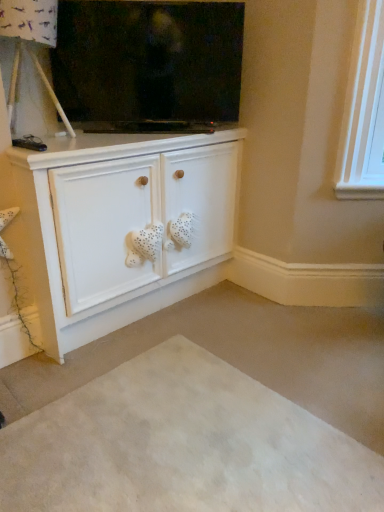
Question: Is flat screen tv at upper center bigger or smaller than beige carpet at lower center?

Choices:
 (A) small
 (B) big

Answer: (B)

Question: Relative to beige carpet at lower center, is flat screen tv at upper center in front or behind?

Choices:
 (A) front
 (B) behind

Answer: (B)

Question: Based on their relative distances, which object is farther from the beige carpet at lower center?

Choices:
 (A) flat screen tv at upper center
 (B) white matte cabinet at center

Answer: (A)

Question: Which is nearer to the beige carpet at lower center?

Choices:
 (A) white matte cabinet at center
 (B) flat screen tv at upper center

Answer: (A)